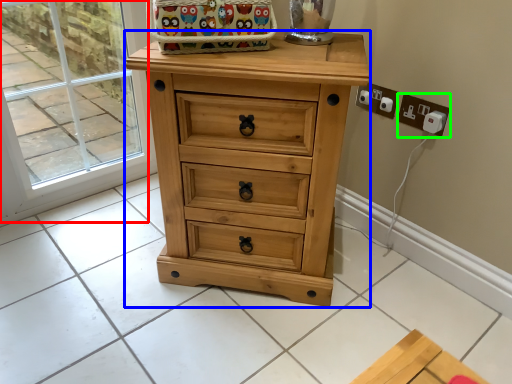
Question: Estimate the real-world distances between objects in this image. Which object is farther from glass door (highlighted by a red box), chest of drawers (highlighted by a blue box) or electric outlet (highlighted by a green box)?

Choices:
 (A) chest of drawers
 (B) electric outlet

Answer: (B)